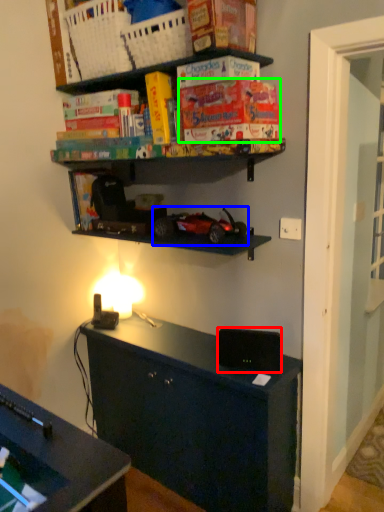
Question: Which is farther away from speaker (highlighted by a red box)? model car (highlighted by a blue box) or paperback book (highlighted by a green box)?

Choices:
 (A) model car
 (B) paperback book

Answer: (B)